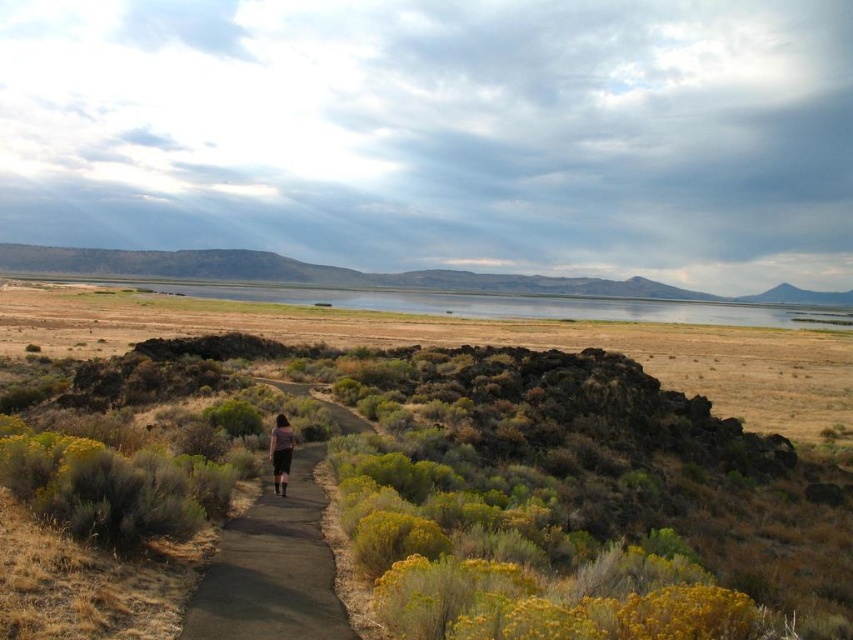
Question: Does black asphalt path at center lie behind dark gray fabric skirt at center?

Choices:
 (A) no
 (B) yes

Answer: (A)

Question: Which object is the farthest from the dark gray fabric skirt at center?

Choices:
 (A) black asphalt path at center
 (B) green shrubs at center

Answer: (B)

Question: Is green shrubs at center positioned behind dark gray fabric skirt at center?

Choices:
 (A) yes
 (B) no

Answer: (B)

Question: Does green shrubs at center have a greater width compared to black asphalt path at center?

Choices:
 (A) yes
 (B) no

Answer: (A)

Question: Which object is closer to the camera taking this photo?

Choices:
 (A) black asphalt path at center
 (B) green shrubs at center

Answer: (B)

Question: Considering the real-world distances, which object is closest to the black asphalt path at center?

Choices:
 (A) dark gray fabric skirt at center
 (B) green shrubs at center

Answer: (A)